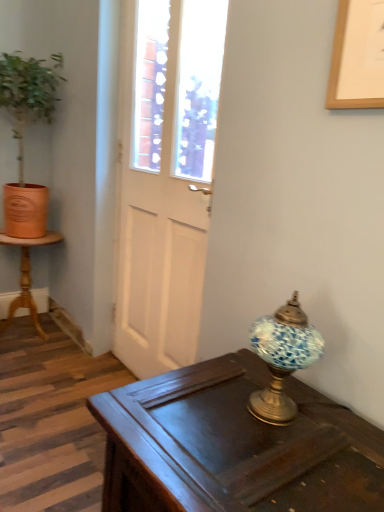
Question: Is blue mosaic glass lamp at right further to the viewer compared to white glossy door at center?

Choices:
 (A) no
 (B) yes

Answer: (A)

Question: Does blue mosaic glass lamp at right have a larger size compared to white glossy door at center?

Choices:
 (A) no
 (B) yes

Answer: (A)

Question: From a real-world perspective, is blue mosaic glass lamp at right located higher than white glossy door at center?

Choices:
 (A) no
 (B) yes

Answer: (A)

Question: Is blue mosaic glass lamp at right outside white glossy door at center?

Choices:
 (A) yes
 (B) no

Answer: (A)

Question: Does blue mosaic glass lamp at right have a smaller size compared to white glossy door at center?

Choices:
 (A) yes
 (B) no

Answer: (A)

Question: Relative to terracotta pot at left, is dark wood desk at center in front or behind?

Choices:
 (A) behind
 (B) front

Answer: (B)

Question: From their relative heights in the image, would you say dark wood desk at center is taller or shorter than terracotta pot at left?

Choices:
 (A) tall
 (B) short

Answer: (B)

Question: Is dark wood desk at center spatially inside terracotta pot at left, or outside of it?

Choices:
 (A) outside
 (B) inside

Answer: (A)

Question: In terms of size, does dark wood desk at center appear bigger or smaller than terracotta pot at left?

Choices:
 (A) small
 (B) big

Answer: (A)

Question: In terms of size, does terracotta pot at left appear bigger or smaller than blue mosaic glass lamp at right?

Choices:
 (A) big
 (B) small

Answer: (A)

Question: Is point (49, 94) positioned closer to the camera than point (266, 391)?

Choices:
 (A) farther
 (B) closer

Answer: (A)

Question: In terms of height, does terracotta pot at left look taller or shorter compared to blue mosaic glass lamp at right?

Choices:
 (A) tall
 (B) short

Answer: (A)

Question: From a real-world perspective, is terracotta pot at left positioned above or below blue mosaic glass lamp at right?

Choices:
 (A) above
 (B) below

Answer: (A)

Question: Considering the relative positions of wooden picture frame at upper right and terracotta pot at left in the image provided, is wooden picture frame at upper right to the left or to the right of terracotta pot at left?

Choices:
 (A) left
 (B) right

Answer: (B)

Question: Is point (379, 71) positioned closer to the camera than point (23, 202)?

Choices:
 (A) closer
 (B) farther

Answer: (A)